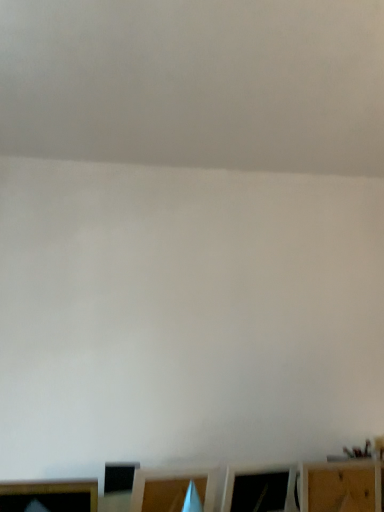
Question: Considering the positions of point (357, 501) and point (39, 486), is point (357, 501) closer or farther from the camera than point (39, 486)?

Choices:
 (A) closer
 (B) farther

Answer: (B)

Question: From a real-world perspective, relative to wooden frame at lower left, marked as the second furniture in a right-to-left arrangement, is wooden shelf at lower right, the 2th furniture when ordered from left to right, vertically above or below?

Choices:
 (A) below
 (B) above

Answer: (B)

Question: Would you say wooden shelf at lower right, the 2th furniture when ordered from left to right, is to the left or to the right of wooden frame at lower left, marked as the second furniture in a right-to-left arrangement, in the picture?

Choices:
 (A) right
 (B) left

Answer: (A)

Question: Considering the positions of wooden frame at lower left, the 1th furniture viewed from the left, and wooden shelf at lower right, which appears as the 1th furniture when viewed from the right, in the image, is wooden frame at lower left, the 1th furniture viewed from the left, wider or thinner than wooden shelf at lower right, which appears as the 1th furniture when viewed from the right,?

Choices:
 (A) thin
 (B) wide

Answer: (B)

Question: From a real-world perspective, relative to wooden shelf at lower right, the 2th furniture when ordered from left to right, is wooden frame at lower left, the 1th furniture viewed from the left, vertically above or below?

Choices:
 (A) above
 (B) below

Answer: (B)

Question: Relative to wooden shelf at lower right, the 2th furniture when ordered from left to right, is wooden frame at lower left, the 1th furniture viewed from the left, in front or behind?

Choices:
 (A) behind
 (B) front

Answer: (B)

Question: Considering the positions of wooden frame at lower left, marked as the second furniture in a right-to-left arrangement, and wooden shelf at lower right, which appears as the 1th furniture when viewed from the right, in the image, is wooden frame at lower left, marked as the second furniture in a right-to-left arrangement, bigger or smaller than wooden shelf at lower right, which appears as the 1th furniture when viewed from the right,?

Choices:
 (A) big
 (B) small

Answer: (A)